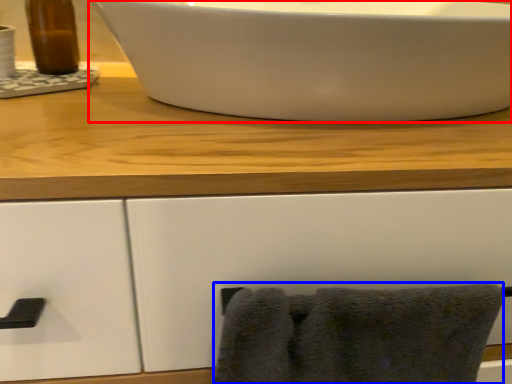
Question: Which object is further to the camera taking this photo, sink (highlighted by a red box) or bath towel (highlighted by a blue box)?

Choices:
 (A) sink
 (B) bath towel

Answer: (B)